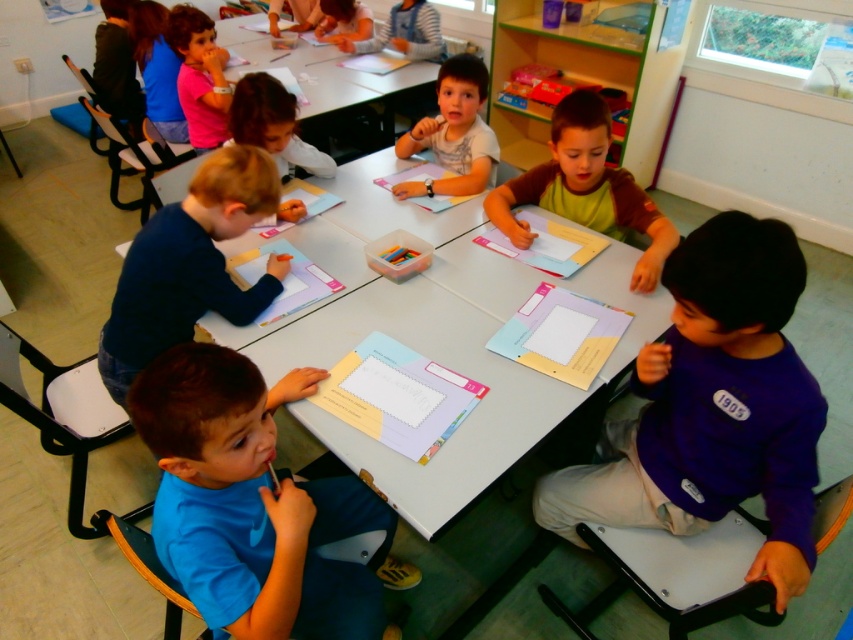
Question: Considering the relative positions of green fabric shirt at center and matte white shirt at center in the image provided, where is green fabric shirt at center located with respect to matte white shirt at center?

Choices:
 (A) right
 (B) left

Answer: (A)

Question: Which point is closer to the camera?

Choices:
 (A) (328, 243)
 (B) (737, 234)
 (C) (268, 301)
 (D) (374, 600)

Answer: (B)

Question: Which object is the farthest from the blue matte shirt at lower left?

Choices:
 (A) matte white shirt at center
 (B) white plastic table at center
 (C) white plastic table at upper center
 (D) green fabric shirt at center

Answer: (C)

Question: Is dark blue shirt at center closer to camera compared to green fabric shirt at center?

Choices:
 (A) no
 (B) yes

Answer: (B)

Question: Which object appears farthest from the camera in this image?

Choices:
 (A) dark blue shirt at center
 (B) white plastic table at center

Answer: (A)

Question: Can you confirm if green fabric shirt at center is positioned to the left of matte white shirt at center?

Choices:
 (A) yes
 (B) no

Answer: (B)